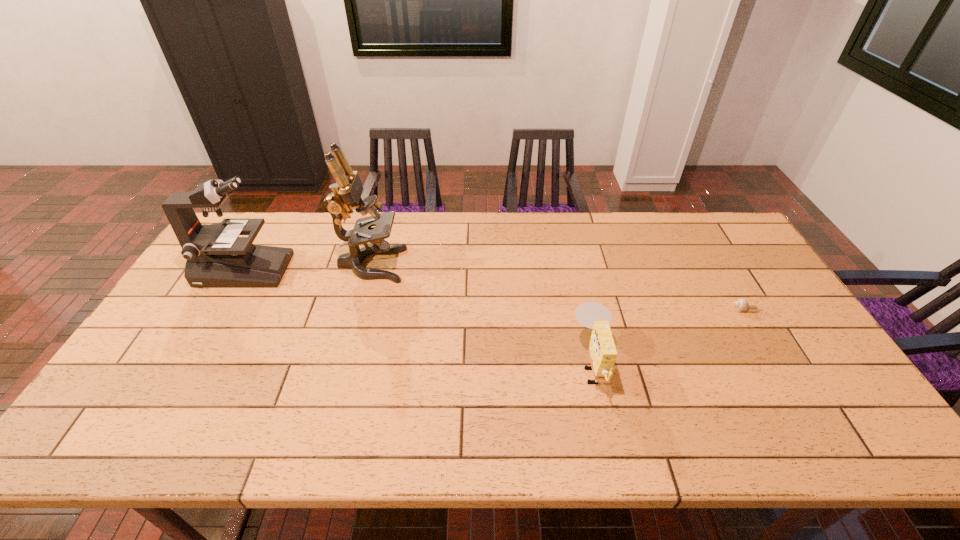
Where is `free space located on the front-facing side of the second shortest object`? The image size is (960, 540). free space located on the front-facing side of the second shortest object is located at coordinates tap(439, 364).

This screenshot has height=540, width=960. What are the coordinates of `vacant space located on the front-facing side of the second shortest object` in the screenshot? It's located at (458, 364).

This screenshot has width=960, height=540. In order to click on free space located on the front-facing side of the second shortest object in this screenshot , I will do `click(443, 364)`.

Where is `vacant space located 0.310m on the shell of the rightmost object`? This screenshot has height=540, width=960. vacant space located 0.310m on the shell of the rightmost object is located at coordinates (623, 309).

Identify the location of free region located on the shell of the rightmost object. Image resolution: width=960 pixels, height=540 pixels. (634, 309).

Image resolution: width=960 pixels, height=540 pixels. I want to click on free space located on the shell of the rightmost object, so click(651, 309).

At what (x,y) coordinates should I click in order to perform the action: click on object that is at the left edge. Please return your answer as a coordinate pair (x, y). The height and width of the screenshot is (540, 960). Looking at the image, I should click on (216, 256).

Where is `object at the right edge`? This screenshot has height=540, width=960. object at the right edge is located at coordinates (741, 305).

Image resolution: width=960 pixels, height=540 pixels. I want to click on object that is at the far left corner, so click(216, 256).

Locate an element on the screen. vacant space at the far edge of the desktop is located at coordinates (632, 236).